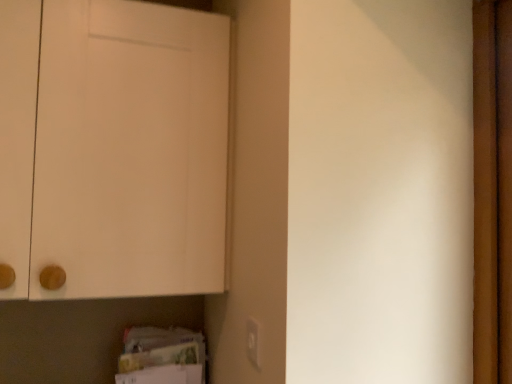
Question: Looking at the image, does white matte cabinet at upper left seem bigger or smaller compared to matte white electric outlet at lower center?

Choices:
 (A) big
 (B) small

Answer: (A)

Question: In terms of width, does white matte cabinet at upper left look wider or thinner when compared to matte white electric outlet at lower center?

Choices:
 (A) wide
 (B) thin

Answer: (A)

Question: Is white matte cabinet at upper left situated inside matte white electric outlet at lower center or outside?

Choices:
 (A) inside
 (B) outside

Answer: (B)

Question: Which is correct: matte white electric outlet at lower center is inside white matte cabinet at upper left, or outside of it?

Choices:
 (A) inside
 (B) outside

Answer: (B)

Question: Considering the positions of matte white electric outlet at lower center and white matte cabinet at upper left in the image, is matte white electric outlet at lower center wider or thinner than white matte cabinet at upper left?

Choices:
 (A) thin
 (B) wide

Answer: (A)

Question: From a real-world perspective, is matte white electric outlet at lower center above or below white matte cabinet at upper left?

Choices:
 (A) above
 (B) below

Answer: (B)

Question: Considering the positions of matte white electric outlet at lower center and white matte cabinet at upper left in the image, is matte white electric outlet at lower center bigger or smaller than white matte cabinet at upper left?

Choices:
 (A) big
 (B) small

Answer: (B)